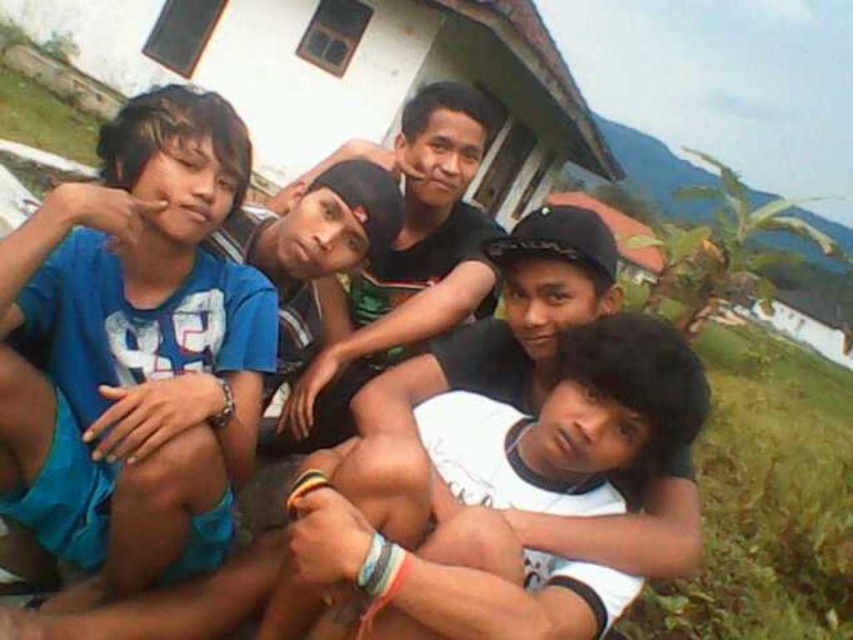
Measure the distance between white matte shirt at lower center and black matte cap at center.

The distance of white matte shirt at lower center from black matte cap at center is 30.12 inches.

Can you confirm if white matte shirt at lower center is wider than black matte cap at center?

Indeed, white matte shirt at lower center has a greater width compared to black matte cap at center.

Describe the element at coordinates (454, 512) in the screenshot. I see `white matte shirt at lower center` at that location.

Find the location of a particular element. The image size is (853, 640). white matte shirt at lower center is located at coordinates (454, 512).

The width and height of the screenshot is (853, 640). Describe the element at coordinates (135, 352) in the screenshot. I see `blue matte shirt at left` at that location.

Does point (149, 576) come in front of point (306, 381)?

Yes, it is in front of point (306, 381).

I want to click on blue matte shirt at left, so click(x=135, y=352).

Between blue matte shirt at left and white matte shirt at lower center, which one is positioned higher?

blue matte shirt at left is above.

Does blue matte shirt at left lie behind white matte shirt at lower center?

Yes, blue matte shirt at left is further from the viewer.

Image resolution: width=853 pixels, height=640 pixels. Describe the element at coordinates (135, 352) in the screenshot. I see `blue matte shirt at left` at that location.

The width and height of the screenshot is (853, 640). I want to click on blue matte shirt at left, so click(x=135, y=352).